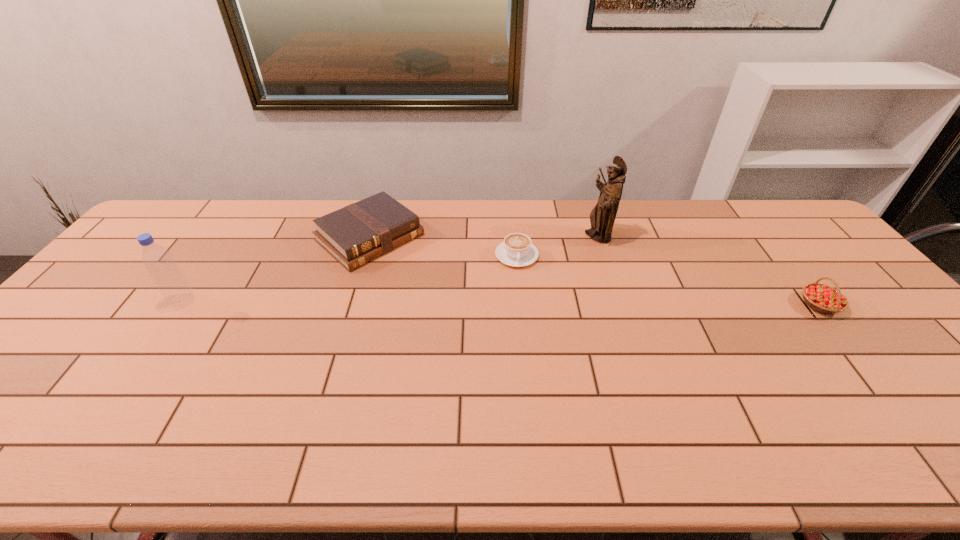
This screenshot has height=540, width=960. I want to click on free spot on the desktop that is between the fourth shortest object and the rightmost object and is positioned on the front-facing side of the tallest object, so click(x=503, y=303).

Where is `free spot on the desktop that is between the bottle and the rightmost object and is positioned on the side of the shortest object with the handle`? This screenshot has height=540, width=960. free spot on the desktop that is between the bottle and the rightmost object and is positioned on the side of the shortest object with the handle is located at coordinates (522, 303).

Identify the location of vacant spot on the desktop that is between the fourth shortest object and the rightmost object and is positioned on the spine side of the fourth object from right to left. (451, 303).